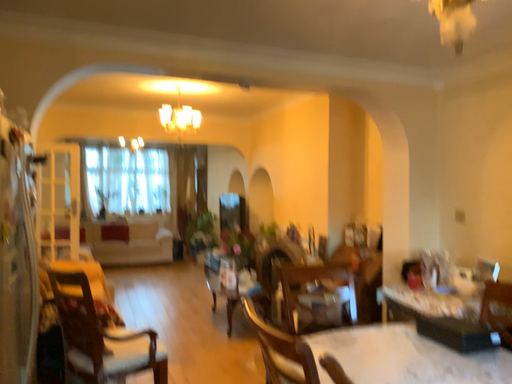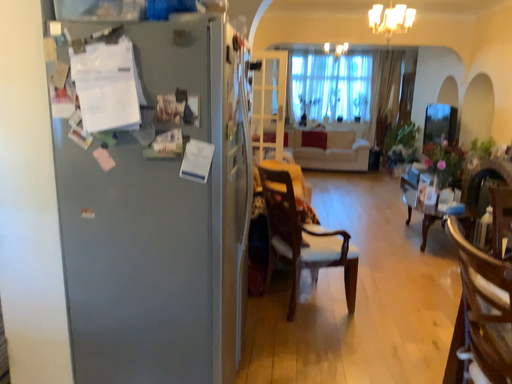
Question: Which way did the camera rotate in the video?

Choices:
 (A) rotated right
 (B) rotated left

Answer: (B)